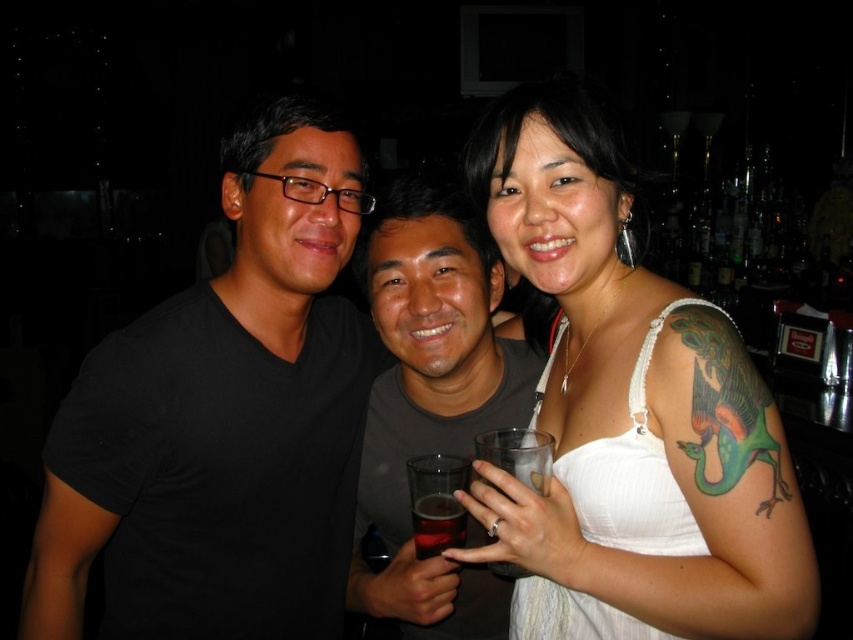
Can you confirm if white fabric dress at center is smaller than translucent glass at center?

No, white fabric dress at center is not smaller than translucent glass at center.

Does white fabric dress at center have a larger size compared to translucent glass at center?

Yes, white fabric dress at center is bigger than translucent glass at center.

Between point (770, 611) and point (457, 500), which one is positioned behind?

The point (457, 500) is behind.

Find the location of `white fabric dress at center`. white fabric dress at center is located at coordinates (630, 401).

Does black matte t-shirt at left appear on the left side of white fabric dress at center?

Correct, you'll find black matte t-shirt at left to the left of white fabric dress at center.

Does point (248, 570) come farther from viewer compared to point (730, 332)?

Yes, point (248, 570) is farther from viewer.

Locate an element on the screen. The image size is (853, 640). black matte t-shirt at left is located at coordinates (223, 420).

Can you confirm if dark gray t-shirt at center is bigger than translucent glass at center?

Yes.

You are a GUI agent. You are given a task and a screenshot of the screen. Output one action in this format:
    pyautogui.click(x=<x>, y=<y>)
    Task: Click on the dark gray t-shirt at center
    Image resolution: width=853 pixels, height=640 pixels.
    Given the screenshot: What is the action you would take?
    pyautogui.click(x=432, y=400)

Is point (494, 579) less distant than point (415, 532)?

No, (494, 579) is behind (415, 532).

Where is `dark gray t-shirt at center`? dark gray t-shirt at center is located at coordinates [x=432, y=400].